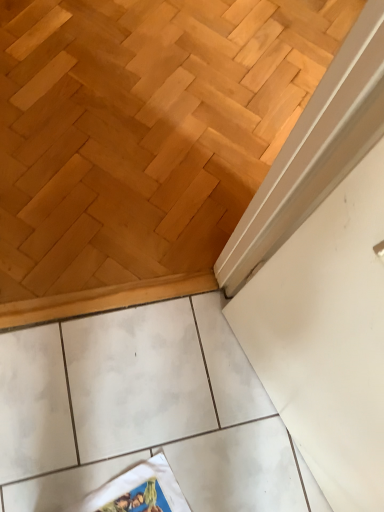
What do you see at coordinates (145, 142) in the screenshot? I see `wooden parquet floor at upper left` at bounding box center [145, 142].

Locate an element on the screen. This screenshot has width=384, height=512. wooden parquet floor at upper left is located at coordinates (145, 142).

Locate an element on the screen. wooden parquet floor at upper left is located at coordinates (145, 142).